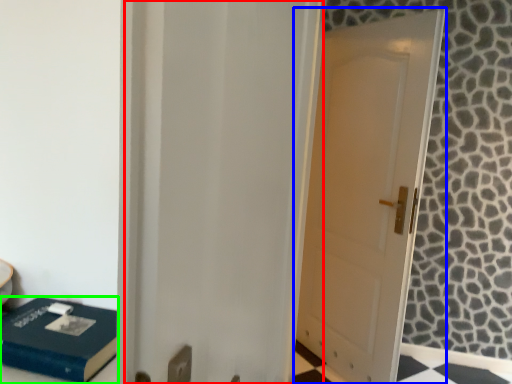
Question: Considering the real-world distances, which object is closest to screen door (highlighted by a red box)? door (highlighted by a blue box) or box (highlighted by a green box).

Choices:
 (A) door
 (B) box

Answer: (B)